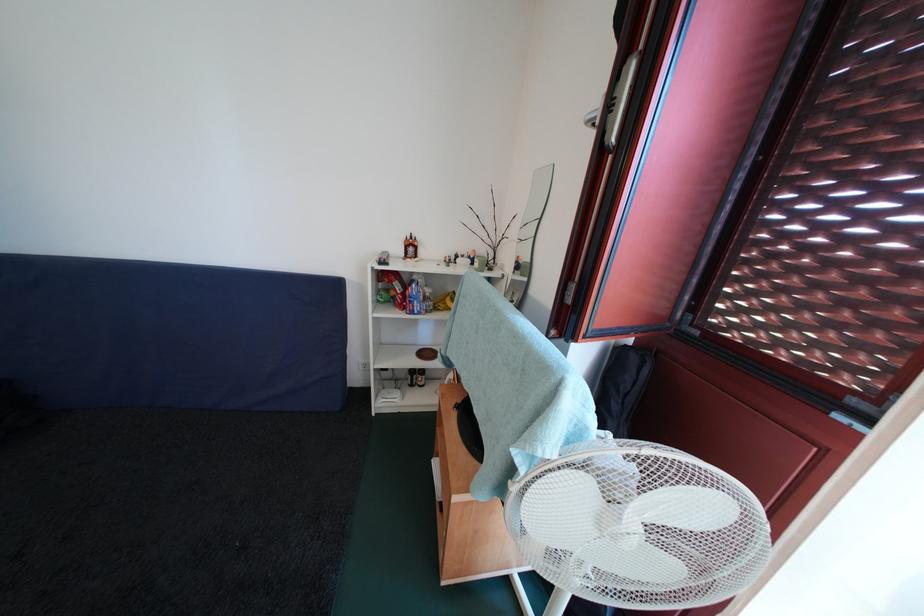
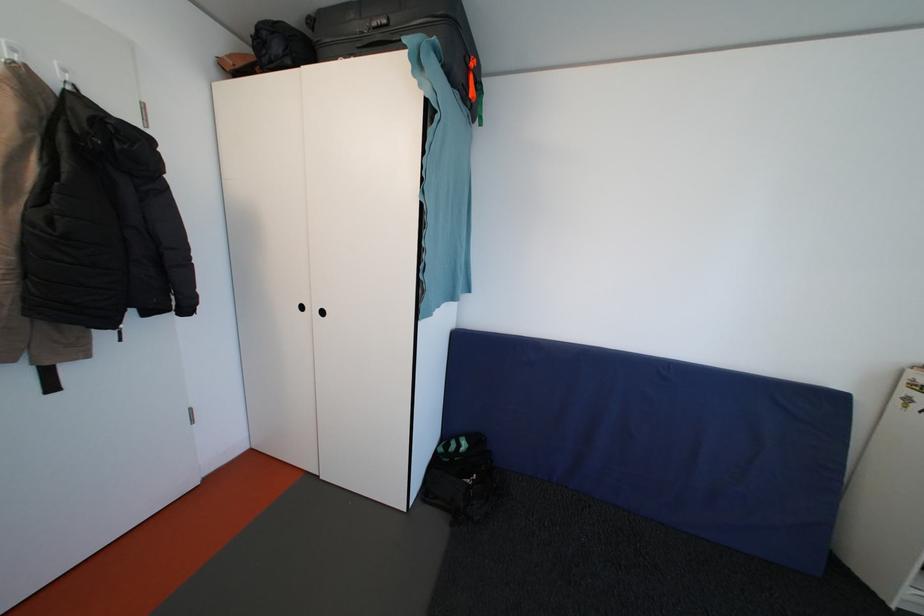
Question: Which direction would the cameraman need to move to produce the second image? Reply with the corresponding letter.

Choices:
 (A) Left
 (B) Right
 (C) Forward
 (D) Backward

Answer: (A)